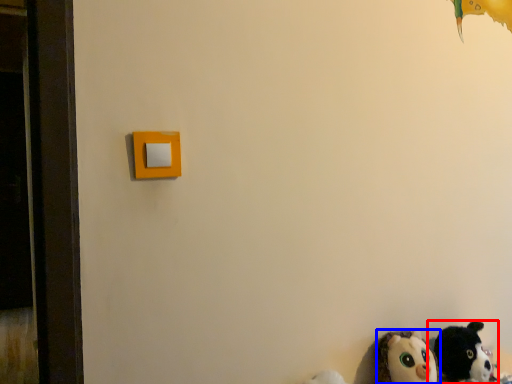
Question: Which point is further to the camera, toy (highlighted by a red box) or toy (highlighted by a blue box)?

Choices:
 (A) toy
 (B) toy

Answer: (A)